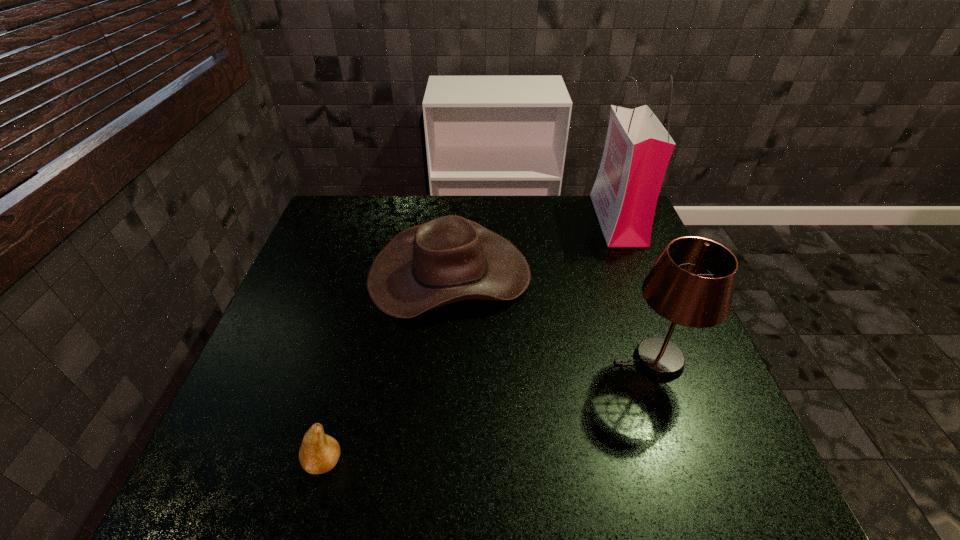
You are a GUI agent. You are given a task and a screenshot of the screen. Output one action in this format:
    pyautogui.click(x=<x>, y=<y>)
    Task: Click on the free space at the far edge of the desktop
    
    Given the screenshot: What is the action you would take?
    pyautogui.click(x=565, y=208)

This screenshot has width=960, height=540. Identify the location of vacant space at the near edge of the desktop. (614, 496).

Find the location of a particular element. The image size is (960, 540). vacant space at the left edge is located at coordinates (x=315, y=251).

In the image, there is a desktop. At what (x,y) coordinates should I click in order to perform the action: click on vacant space at the right edge. Please return your answer as a coordinate pair (x, y). The height and width of the screenshot is (540, 960). Looking at the image, I should click on (601, 241).

What are the coordinates of `vacant space at the near right corner` in the screenshot? It's located at tap(745, 498).

The image size is (960, 540). Identify the location of unoccupied position between the shortest object and the shopping bag. (470, 341).

Identify the location of blank region between the lampshade and the third tallest object. Image resolution: width=960 pixels, height=540 pixels. (552, 318).

Locate an element on the screen. vacant point located between the pear and the shopping bag is located at coordinates (470, 341).

Where is `vacant area between the third farthest object and the shortest object`? This screenshot has width=960, height=540. vacant area between the third farthest object and the shortest object is located at coordinates (490, 411).

At what (x,y) coordinates should I click in order to perform the action: click on free spot between the shopping bag and the cowboy hat. Please return your answer as a coordinate pair (x, y). The height and width of the screenshot is (540, 960). Looking at the image, I should click on (534, 247).